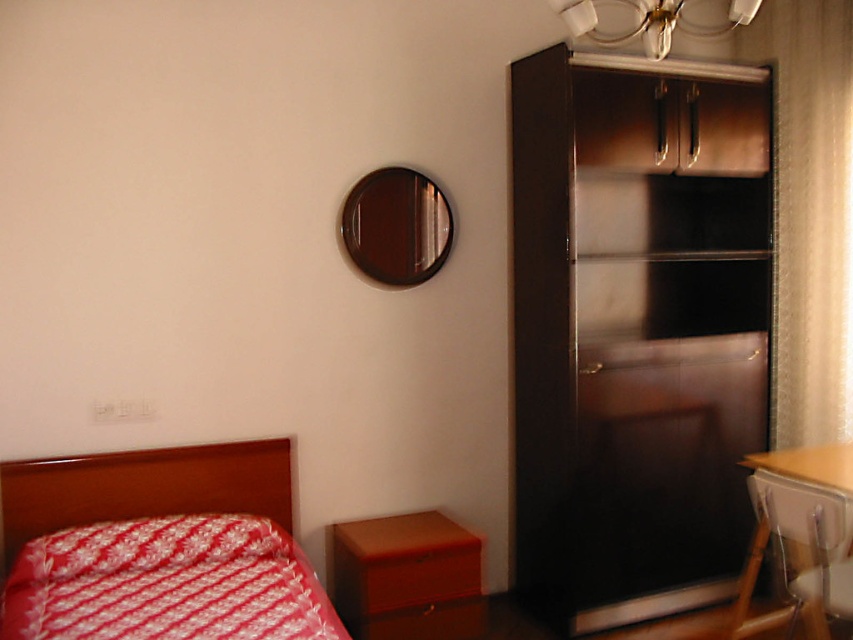
Is point (663, 86) positioned after point (596, 26)?

No, it is in front of (596, 26).

Find the location of a particular element. The height and width of the screenshot is (640, 853). metallic silver drawer at upper right is located at coordinates (x=670, y=124).

Does black glossy cabinet at right have a greater height compared to matte brown drawer at lower center?

Yes, black glossy cabinet at right is taller than matte brown drawer at lower center.

Measure the distance between point (x=567, y=468) and camera.

The distance of point (x=567, y=468) from camera is 3.08 meters.

Locate an element on the screen. The height and width of the screenshot is (640, 853). black glossy cabinet at right is located at coordinates (635, 330).

Who is more forward, (793, 625) or (450, 545)?

Positioned in front is point (793, 625).

Who is positioned more to the left, wooden chair at lower right or matte brown drawer at lower center?

matte brown drawer at lower center

Is point (761, 518) positioned before point (368, 612)?

Yes, it is in front of point (368, 612).

The image size is (853, 640). In order to click on wooden chair at lower right in this screenshot , I will do `click(802, 545)`.